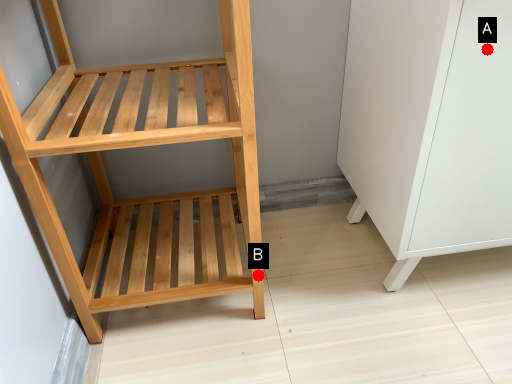
Question: Two points are circled on the image, labeled by A and B beside each circle. Which point is closer to the camera taking this photo?

Choices:
 (A) A is closer
 (B) B is closer

Answer: (A)